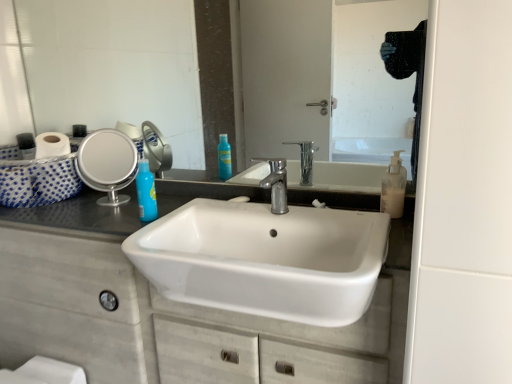
Question: Considering the positions of glossy glass mirror at upper center, marked as the second mirror in a left-to-right arrangement, and blue glossy bottle at upper left in the image, is glossy glass mirror at upper center, marked as the second mirror in a left-to-right arrangement, wider or thinner than blue glossy bottle at upper left?

Choices:
 (A) thin
 (B) wide

Answer: (A)

Question: Is glossy glass mirror at upper center, the first mirror in the right-to-left sequence, inside the boundaries of blue glossy bottle at upper left, or outside?

Choices:
 (A) outside
 (B) inside

Answer: (A)

Question: Estimate the real-world distances between objects in this image. Which object is farther from the blue glossy bottle at upper left?

Choices:
 (A) white ceramic sink at center
 (B) white matte cabinet at center
 (C) translucent plastic soap dispenser at right
 (D) glossy glass mirror at upper center, the first mirror in the right-to-left sequence
 (E) polished chrome faucet at center

Answer: (C)

Question: Which is farther from the white matte cabinet at center?

Choices:
 (A) silver metallic mirror at left, the 2th mirror viewed from the right
 (B) polished chrome faucet at center
 (C) translucent plastic soap dispenser at right
 (D) white ceramic sink at center
 (E) blue glossy bottle at upper left

Answer: (C)